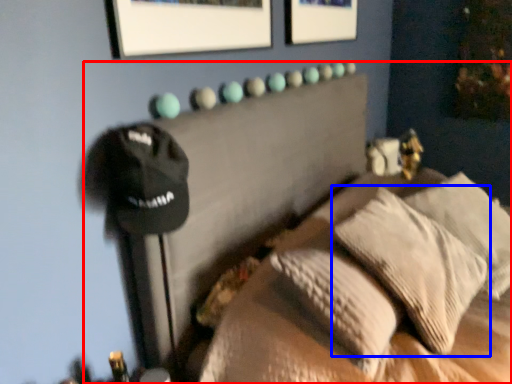
Question: Which point is further to the camera, furniture (highlighted by a red box) or pillow (highlighted by a blue box)?

Choices:
 (A) furniture
 (B) pillow

Answer: (B)